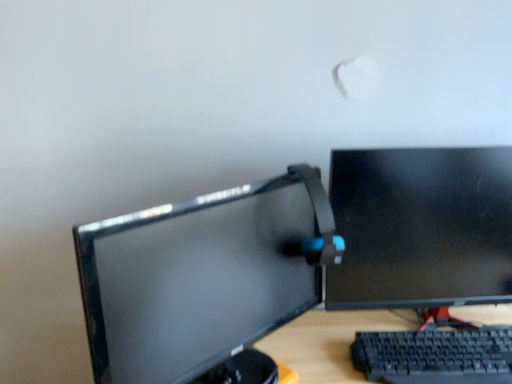
Describe the element at coordinates (436, 356) in the screenshot. I see `black plastic keyboard at lower right` at that location.

Identify the location of matte black monitor at center, arranged as the second computer monitor when viewed from the right. (202, 276).

In order to click on black plastic keyboard at lower right in this screenshot , I will do `click(436, 356)`.

Is black plastic keyboard at lower right thinner than black glossy monitor at right, the 1th computer monitor in the right-to-left sequence?

No, black plastic keyboard at lower right is not thinner than black glossy monitor at right, the 1th computer monitor in the right-to-left sequence.

Considering the points (392, 340) and (466, 232), which point is in front, point (392, 340) or point (466, 232)?

The point (392, 340) is in front.

From the image's perspective, is black plastic keyboard at lower right located above black glossy monitor at right, the 1th computer monitor in the right-to-left sequence?

No, from the image's perspective, black plastic keyboard at lower right is not over black glossy monitor at right, the 1th computer monitor in the right-to-left sequence.

Is black plastic keyboard at lower right positioned far away from black glossy monitor at right, which appears as the 2th computer monitor when viewed from the left?

No.

Which is in front, point (114, 248) or point (352, 226)?

The point (114, 248) is more forward.

Looking at this image, from a real-world perspective, is matte black monitor at center, which appears as the first computer monitor when viewed from the left, physically below black glossy monitor at right, which appears as the 2th computer monitor when viewed from the left?

Yes.

From the picture: Between matte black monitor at center, which appears as the first computer monitor when viewed from the left, and black glossy monitor at right, the 1th computer monitor in the right-to-left sequence, which one has more height?

black glossy monitor at right, the 1th computer monitor in the right-to-left sequence, is taller.

Between matte black monitor at center, arranged as the second computer monitor when viewed from the right, and black plastic keyboard at lower right, which one has less height?

black plastic keyboard at lower right is shorter.

Locate an element on the screen. The image size is (512, 384). the 1st computer monitor above when counting from the black plastic keyboard at lower right (from the image's perspective) is located at coordinates (202, 276).

Is matte black monitor at center, which appears as the first computer monitor when viewed from the left, not inside black plastic keyboard at lower right?

Yes, matte black monitor at center, which appears as the first computer monitor when viewed from the left, is outside of black plastic keyboard at lower right.

Can you confirm if matte black monitor at center, arranged as the second computer monitor when viewed from the right, is smaller than black plastic keyboard at lower right?

Actually, matte black monitor at center, arranged as the second computer monitor when viewed from the right, might be larger than black plastic keyboard at lower right.

What's the angular difference between black glossy monitor at right, the 1th computer monitor in the right-to-left sequence, and matte black monitor at center, arranged as the second computer monitor when viewed from the right,'s facing directions?

They differ by 42.8 degrees in their facing directions.

Considering the relative positions of black glossy monitor at right, the 1th computer monitor in the right-to-left sequence, and matte black monitor at center, which appears as the first computer monitor when viewed from the left, in the image provided, is black glossy monitor at right, the 1th computer monitor in the right-to-left sequence, behind matte black monitor at center, which appears as the first computer monitor when viewed from the left,?

Yes, the depth of black glossy monitor at right, the 1th computer monitor in the right-to-left sequence, is greater than that of matte black monitor at center, which appears as the first computer monitor when viewed from the left.

Considering the sizes of objects black glossy monitor at right, the 1th computer monitor in the right-to-left sequence, and matte black monitor at center, arranged as the second computer monitor when viewed from the right, in the image provided, who is taller, black glossy monitor at right, the 1th computer monitor in the right-to-left sequence, or matte black monitor at center, arranged as the second computer monitor when viewed from the right,?

Standing taller between the two is black glossy monitor at right, the 1th computer monitor in the right-to-left sequence.

Is matte black monitor at center, arranged as the second computer monitor when viewed from the right, at the back of black glossy monitor at right, the 1th computer monitor in the right-to-left sequence?

No, black glossy monitor at right, the 1th computer monitor in the right-to-left sequence, is not facing away from matte black monitor at center, arranged as the second computer monitor when viewed from the right.

Is black glossy monitor at right, the 1th computer monitor in the right-to-left sequence, facing towards black plastic keyboard at lower right?

Yes.

Which is correct: black glossy monitor at right, the 1th computer monitor in the right-to-left sequence, is inside black plastic keyboard at lower right, or outside of it?

The correct answer is: outside.

Measure the distance between black glossy monitor at right, the 1th computer monitor in the right-to-left sequence, and black plastic keyboard at lower right.

black glossy monitor at right, the 1th computer monitor in the right-to-left sequence, is 7.82 inches away from black plastic keyboard at lower right.

The height and width of the screenshot is (384, 512). Find the location of `computer keyboard directly beneath the black glossy monitor at right, the 1th computer monitor in the right-to-left sequence (from a real-world perspective)`. computer keyboard directly beneath the black glossy monitor at right, the 1th computer monitor in the right-to-left sequence (from a real-world perspective) is located at coordinates (436, 356).

Based on the photo, is the depth of black plastic keyboard at lower right less than that of matte black monitor at center, which appears as the first computer monitor when viewed from the left?

No, the depth of black plastic keyboard at lower right is greater than that of matte black monitor at center, which appears as the first computer monitor when viewed from the left.

Looking at this image, from a real-world perspective, is black plastic keyboard at lower right beneath matte black monitor at center, which appears as the first computer monitor when viewed from the left?

Correct, in the physical world, black plastic keyboard at lower right is lower than matte black monitor at center, which appears as the first computer monitor when viewed from the left.

You are a GUI agent. You are given a task and a screenshot of the screen. Output one action in this format:
    pyautogui.click(x=<x>, y=<y>)
    Task: Click on the computer keyboard lying on the right of matte black monitor at center, which appears as the first computer monitor when viewed from the left
    The height and width of the screenshot is (384, 512).
    Given the screenshot: What is the action you would take?
    pyautogui.click(x=436, y=356)

Is matte black monitor at center, arranged as the second computer monitor when viewed from the right, inside black plastic keyboard at lower right?

No, black plastic keyboard at lower right does not contain matte black monitor at center, arranged as the second computer monitor when viewed from the right.

At what (x,y) coordinates should I click in order to perform the action: click on computer keyboard in front of the black glossy monitor at right, the 1th computer monitor in the right-to-left sequence. Please return your answer as a coordinate pair (x, y). This screenshot has width=512, height=384. Looking at the image, I should click on click(x=436, y=356).

The width and height of the screenshot is (512, 384). What are the coordinates of `computer monitor below the black glossy monitor at right, the 1th computer monitor in the right-to-left sequence (from a real-world perspective)` in the screenshot? It's located at (202, 276).

Looking at the image, which one is located further to black glossy monitor at right, which appears as the 2th computer monitor when viewed from the left, matte black monitor at center, which appears as the first computer monitor when viewed from the left, or black plastic keyboard at lower right?

matte black monitor at center, which appears as the first computer monitor when viewed from the left, is further to black glossy monitor at right, which appears as the 2th computer monitor when viewed from the left.

Looking at the image, which one is located closer to black plastic keyboard at lower right, black glossy monitor at right, which appears as the 2th computer monitor when viewed from the left, or matte black monitor at center, arranged as the second computer monitor when viewed from the right?

black glossy monitor at right, which appears as the 2th computer monitor when viewed from the left, is closer to black plastic keyboard at lower right.

When comparing their distances from matte black monitor at center, arranged as the second computer monitor when viewed from the right, does black plastic keyboard at lower right or black glossy monitor at right, which appears as the 2th computer monitor when viewed from the left, seem closer?

black glossy monitor at right, which appears as the 2th computer monitor when viewed from the left.

Based on their spatial positions, is matte black monitor at center, which appears as the first computer monitor when viewed from the left, or black glossy monitor at right, which appears as the 2th computer monitor when viewed from the left, further from black plastic keyboard at lower right?

Among the two, matte black monitor at center, which appears as the first computer monitor when viewed from the left, is located further to black plastic keyboard at lower right.

Considering their positions, is black glossy monitor at right, which appears as the 2th computer monitor when viewed from the left, positioned further to matte black monitor at center, arranged as the second computer monitor when viewed from the right, than black plastic keyboard at lower right?

The object further to matte black monitor at center, arranged as the second computer monitor when viewed from the right, is black plastic keyboard at lower right.

Which object lies further to the anchor point black glossy monitor at right, the 1th computer monitor in the right-to-left sequence, black plastic keyboard at lower right or matte black monitor at center, which appears as the first computer monitor when viewed from the left?

matte black monitor at center, which appears as the first computer monitor when viewed from the left.

The image size is (512, 384). I want to click on computer monitor between matte black monitor at center, arranged as the second computer monitor when viewed from the right, and black plastic keyboard at lower right from left to right, so click(x=421, y=227).